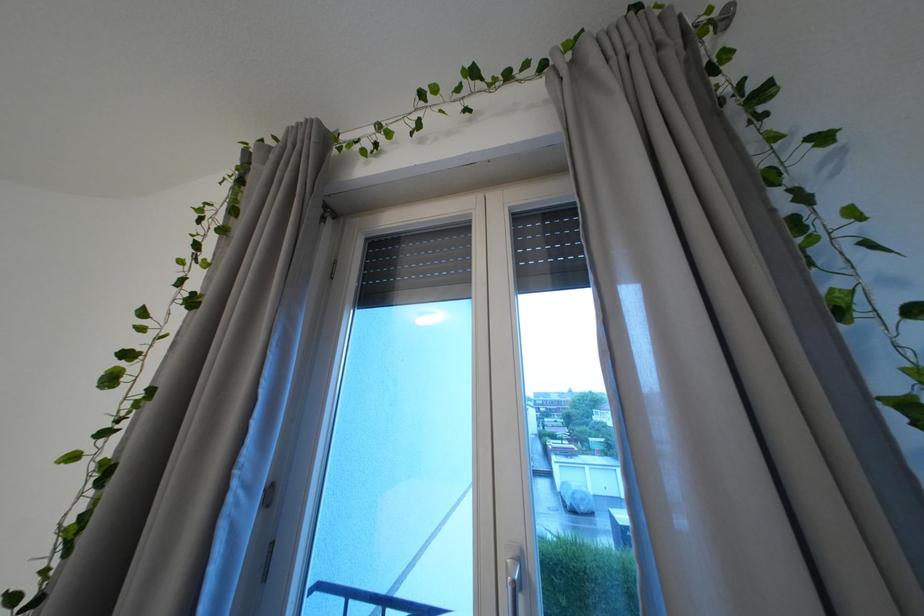
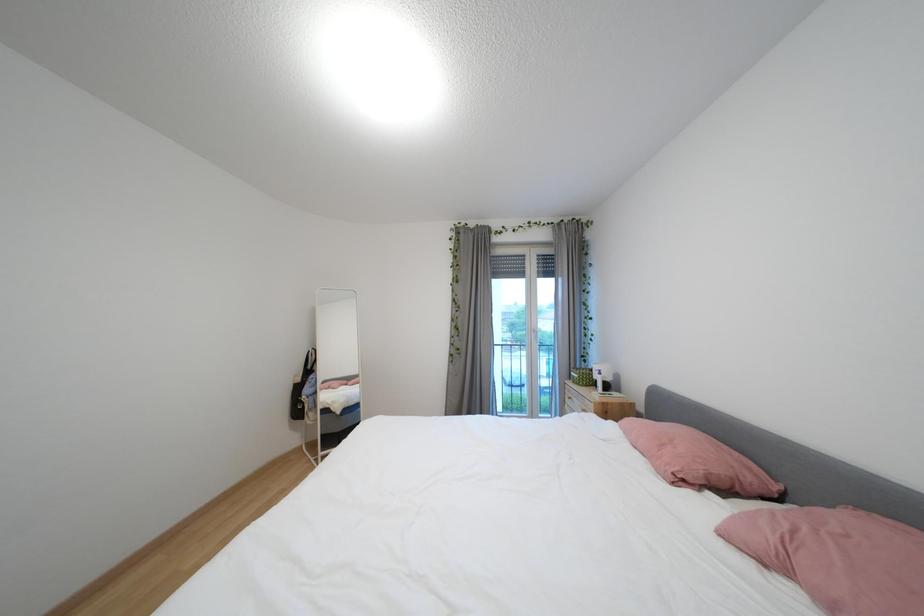
Which direction would the cameraman need to move to produce the second image?

The cameraman moved toward left, backward.